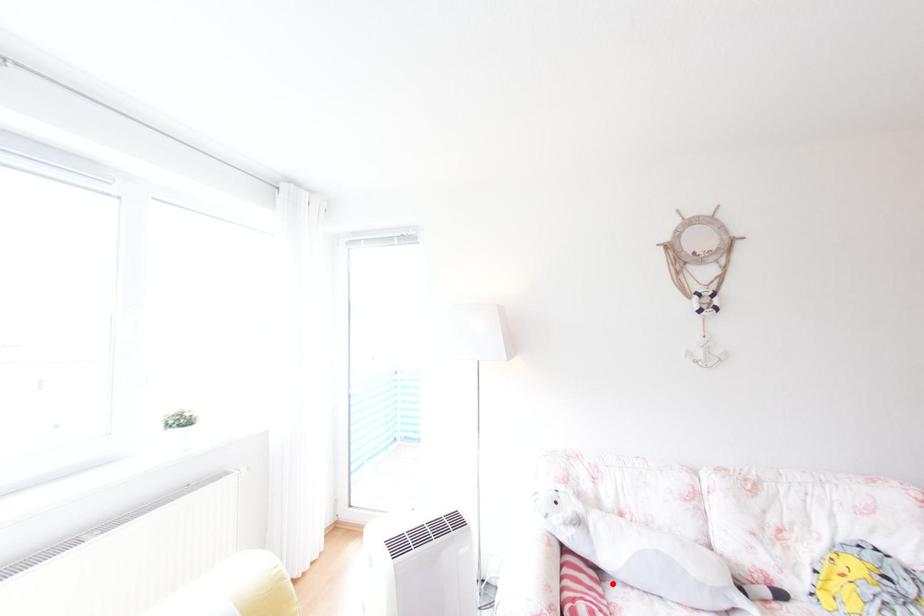
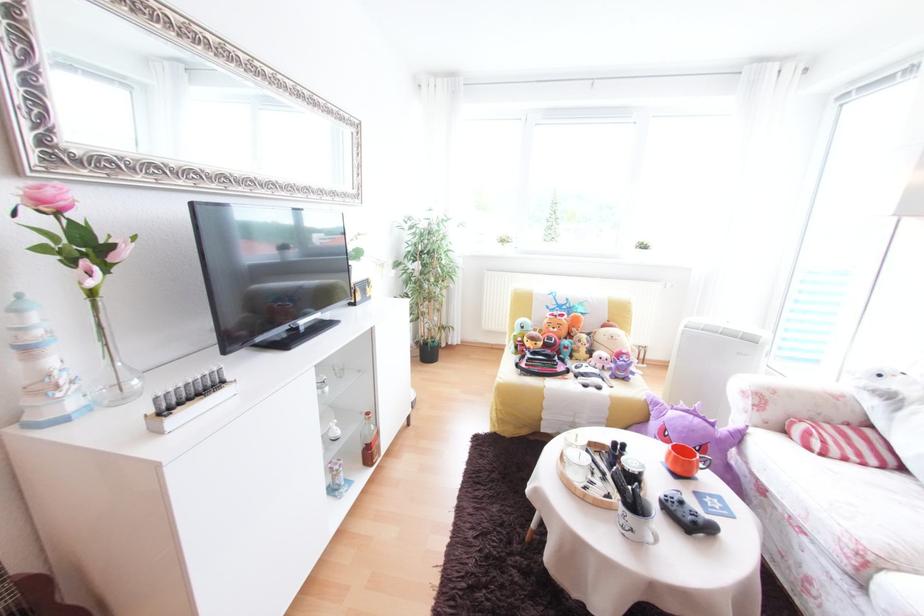
Question: A red point is marked in image1. In image2, is the corresponding 3D point closer to the camera or farther? Reply with the corresponding letter.

Choices:
 (A) The corresponding 3D point is closer.
 (B) The corresponding 3D point is farther.

Answer: (B)